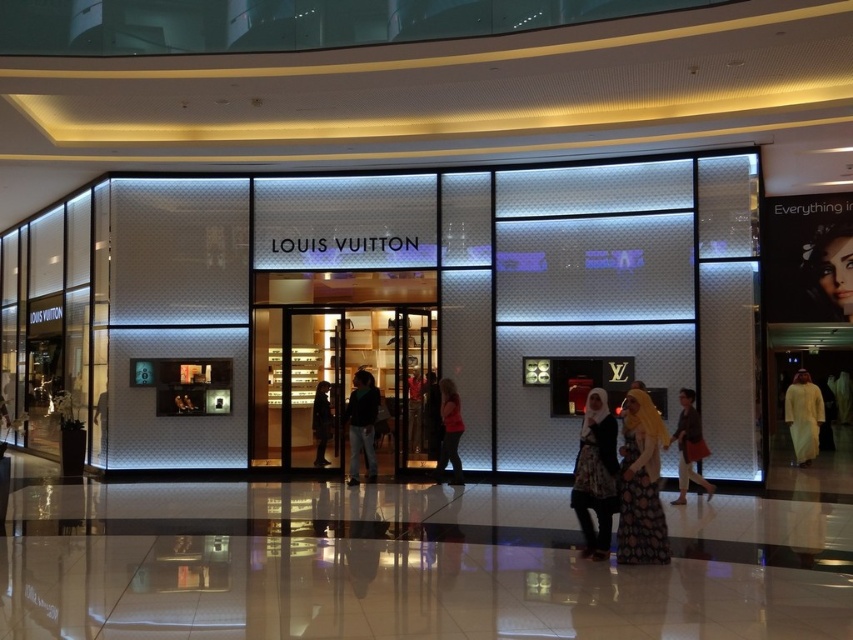
Question: Among these objects, which one is farthest from the camera?

Choices:
 (A) matte brown dress at lower right
 (B) matte black jacket at center
 (C) dark green jacket at center
 (D) dark fabric coat at center

Answer: (D)

Question: Which of the following is the farthest from the observer?

Choices:
 (A) (457, 403)
 (B) (624, 404)

Answer: (A)

Question: Is printed fabric dress at center smaller than light beige fabric abaya at right?

Choices:
 (A) no
 (B) yes

Answer: (A)

Question: Where is smooth skin face at upper right located in relation to matte brown dress at lower right in the image?

Choices:
 (A) left
 (B) right

Answer: (B)

Question: Estimate the real-world distances between objects in this image. Which object is closer to the dark fabric coat at center?

Choices:
 (A) dark green jacket at center
 (B) printed fabric dress at center
 (C) smooth skin face at upper right
 (D) red matte jacket at center

Answer: (A)

Question: Considering the relative positions of dark green jacket at center and dark fabric coat at center in the image provided, where is dark green jacket at center located with respect to dark fabric coat at center?

Choices:
 (A) left
 (B) right

Answer: (B)